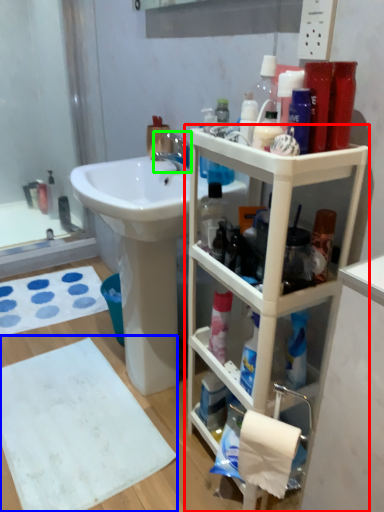
Question: Considering the real-world distances, which object is farthest from bathroom cabinet (highlighted by a red box)? bath towel (highlighted by a blue box) or tap (highlighted by a green box)?

Choices:
 (A) bath towel
 (B) tap

Answer: (B)